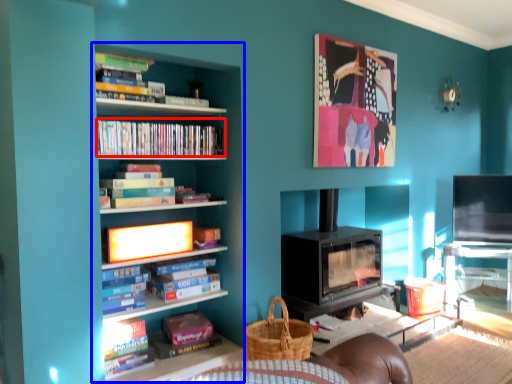
Question: Which object appears farthest to the camera in this image, book (highlighted by a red box) or bookcase (highlighted by a blue box)?

Choices:
 (A) book
 (B) bookcase

Answer: (A)